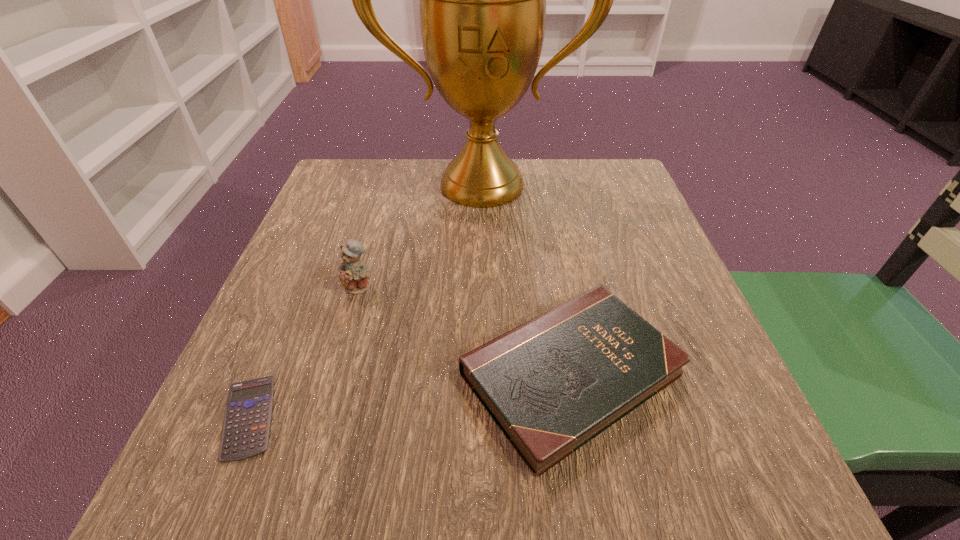
I want to click on object located at the near left corner, so (x=246, y=427).

At what (x,y) coordinates should I click in order to perform the action: click on object present at the far right corner. Please return your answer as a coordinate pair (x, y). The height and width of the screenshot is (540, 960). Looking at the image, I should click on (482, 0).

Locate an element on the screen. The height and width of the screenshot is (540, 960). object positioned at the near right corner is located at coordinates (552, 384).

Find the location of `free spot at the far edge of the desktop`. free spot at the far edge of the desktop is located at coordinates [564, 205].

In the image, there is a desktop. Where is `free region at the left edge`? free region at the left edge is located at coordinates (309, 253).

In the image, there is a desktop. Find the location of `free space at the right edge`. free space at the right edge is located at coordinates click(x=645, y=225).

Where is `free space at the far left corner of the desktop`? Image resolution: width=960 pixels, height=540 pixels. free space at the far left corner of the desktop is located at coordinates (338, 164).

You are a GUI agent. You are given a task and a screenshot of the screen. Output one action in this format:
    pyautogui.click(x=<x>, y=<y>)
    Task: Click on the free space at the far right corner
    This screenshot has width=960, height=540.
    Given the screenshot: What is the action you would take?
    pyautogui.click(x=620, y=168)

Identify the location of free area in between the shortest object and the farthest object. (366, 301).

What are the coordinates of `free space between the teddy bear and the leftmost object` in the screenshot? It's located at (304, 352).